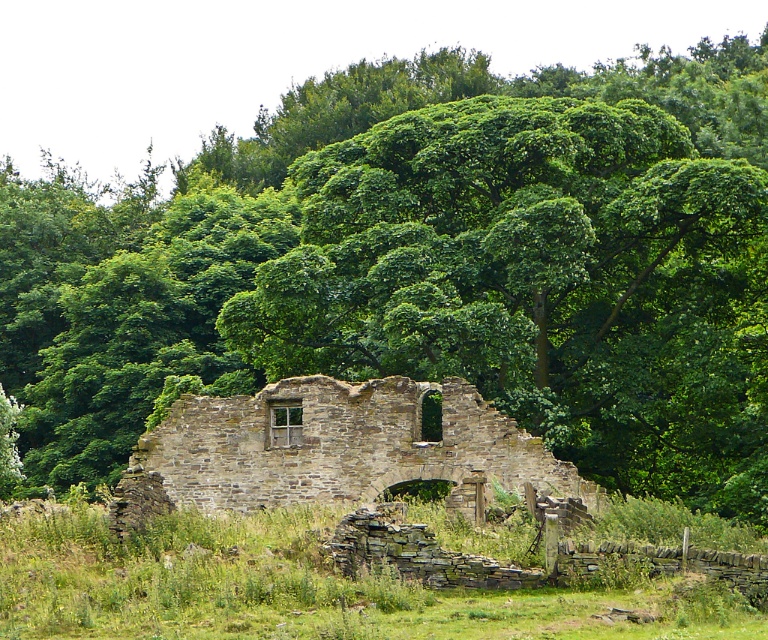
You are standing at the edge of the scene and want to walk towards the green grass at center. Based on the coordinates provided, which direction should you head to reach it?

The green grass at center is located at coordinates point (305, 588). Since the coordinates are given in a standard image coordinate system where the origin is at the top left corner, the x increases to the right and y increases downward. Therefore, to reach the green grass at center, you should move towards the lower right direction from your current position at the edge.